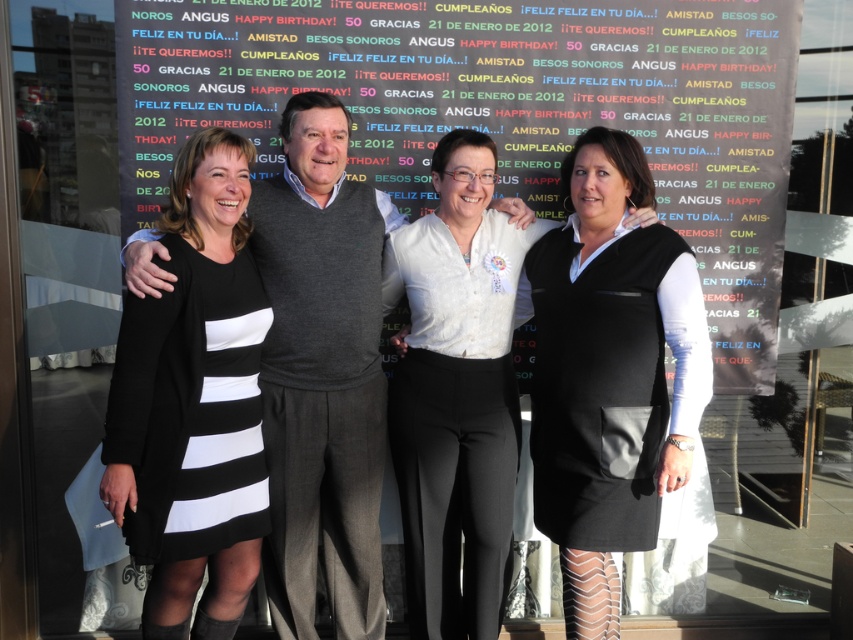
You are a photographer trying to adjust the lighting for the group photo. Since the two central figures are wearing the matte black dress at center and the white textured blouse at center, which one might need more light to ensure visibility?

The matte black dress at center might need more light because darker colors absorb more light and can appear less visible in photos compared to lighter colors like the white textured blouse at center.

You are a photographer setting up for a group photo. You need to position a new subject so they can be seen clearly in front of the multicolored fabric banner at center without blocking the black matte dress at left. Where should you place the new subject?

The multicolored fabric banner at center is located above the black matte dress at left, so placing the new subject in front of the banner but slightly to the right of the black matte dress at left would ensure they are visible without blocking it.